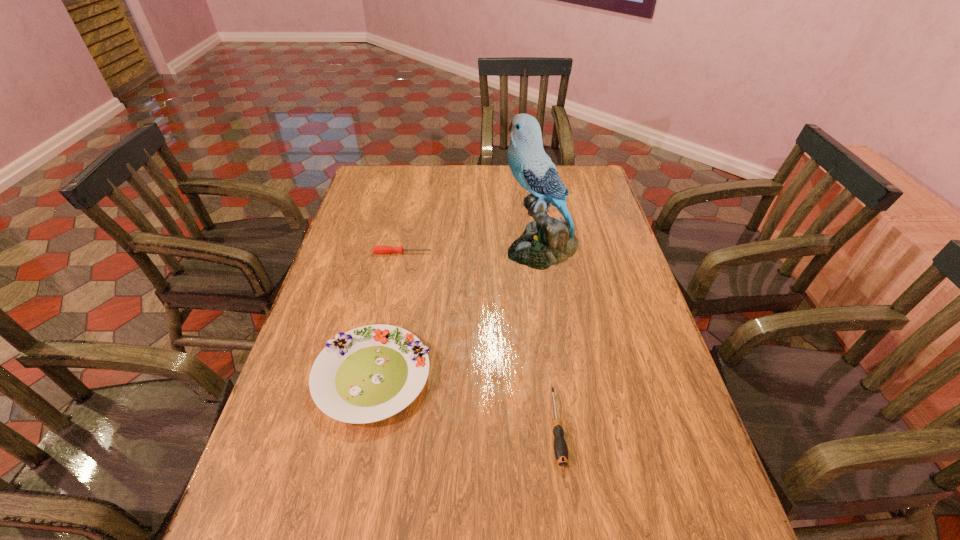
The width and height of the screenshot is (960, 540). Find the location of `unoccupied position between the taller screwdriver and the shorter screwdriver`. unoccupied position between the taller screwdriver and the shorter screwdriver is located at coordinates (480, 340).

Locate an element on the screen. The height and width of the screenshot is (540, 960). vacant area between the tallest object and the shorter screwdriver is located at coordinates point(471,251).

Where is `blank region between the left screwdriver and the salad plate`? The width and height of the screenshot is (960, 540). blank region between the left screwdriver and the salad plate is located at coordinates (388, 314).

Where is `vacant space in between the second tallest object and the tallest object`? This screenshot has height=540, width=960. vacant space in between the second tallest object and the tallest object is located at coordinates (457, 313).

Identify the location of free area in between the tallest object and the third shortest object. (457, 313).

Where is `vacant space that is in between the second tallest object and the tallest object`? Image resolution: width=960 pixels, height=540 pixels. vacant space that is in between the second tallest object and the tallest object is located at coordinates (457, 313).

At what (x,y) coordinates should I click in order to perform the action: click on unoccupied position between the parakeet and the farther screwdriver. Please return your answer as a coordinate pair (x, y). The height and width of the screenshot is (540, 960). Looking at the image, I should click on (471, 251).

Where is `free space between the shorter screwdriver and the parakeet`? free space between the shorter screwdriver and the parakeet is located at coordinates (471, 251).

The width and height of the screenshot is (960, 540). I want to click on object that ranks as the closest to the nearer screwdriver, so click(x=368, y=374).

Select which object appears as the closest to the farther screwdriver. Please provide its 2D coordinates. Your answer should be formatted as a tuple, i.e. [(x, y)], where the tuple contains the x and y coordinates of a point satisfying the conditions above.

[(547, 241)]